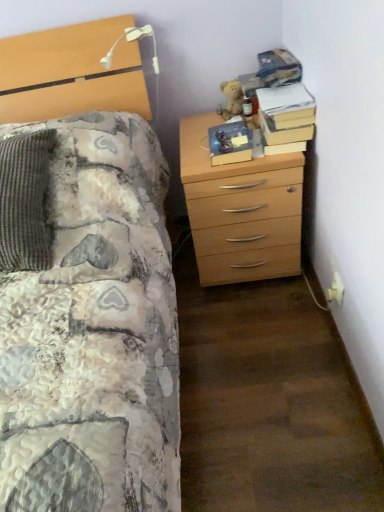
What do you see at coordinates (240, 209) in the screenshot? I see `light wood chest of drawers at right` at bounding box center [240, 209].

Locate an element on the screen. This screenshot has height=512, width=384. fuzzy brown teddy bear at upper right is located at coordinates click(231, 99).

You are a GUI agent. You are given a task and a screenshot of the screen. Output one action in this format:
    pyautogui.click(x=<x>, y=<y>)
    Task: Click on the hardcover book at upper right, positioned as the 2th book in left-to-right order
    The width and height of the screenshot is (384, 512).
    Given the screenshot: What is the action you would take?
    pyautogui.click(x=286, y=114)

Can we say fuzzy brown teddy bear at upper right lies outside hardcover book at upper right, which appears as the first book when viewed from the right?

Yes, fuzzy brown teddy bear at upper right is not within hardcover book at upper right, which appears as the first book when viewed from the right.

Between point (239, 111) and point (283, 121), which one is positioned behind?

The point (239, 111) is farther.

Does fuzzy brown teddy bear at upper right have a greater height compared to hardcover book at upper right, which appears as the first book when viewed from the right?

Correct, fuzzy brown teddy bear at upper right is much taller as hardcover book at upper right, which appears as the first book when viewed from the right.

Is hardcover book at center, which is the first book in left-to-right order, far from white plastic electric outlet at lower right?

They are positioned close to each other.

Is white plastic electric outlet at lower right completely or partially inside hardcover book at center, the second book in the right-to-left sequence?

No, hardcover book at center, the second book in the right-to-left sequence, does not contain white plastic electric outlet at lower right.

Is hardcover book at center, which is the first book in left-to-right order, wider than white plastic electric outlet at lower right?

Indeed, hardcover book at center, which is the first book in left-to-right order, has a greater width compared to white plastic electric outlet at lower right.

From a real-world perspective, is hardcover book at center, the second book in the right-to-left sequence, physically located above or below white plastic electric outlet at lower right?

Clearly, from a real-world perspective, hardcover book at center, the second book in the right-to-left sequence, is above white plastic electric outlet at lower right.

Is hardcover book at upper right, positioned as the 2th book in left-to-right order, oriented towards hardcover book at center, the second book in the right-to-left sequence?

No, hardcover book at upper right, positioned as the 2th book in left-to-right order, is not facing towards hardcover book at center, the second book in the right-to-left sequence.

Considering the relative positions of hardcover book at upper right, positioned as the 2th book in left-to-right order, and hardcover book at center, the second book in the right-to-left sequence, in the image provided, is hardcover book at upper right, positioned as the 2th book in left-to-right order, to the left of hardcover book at center, the second book in the right-to-left sequence, from the viewer's perspective?

No.

Can you confirm if hardcover book at upper right, which appears as the first book when viewed from the right, is taller than hardcover book at center, which is the first book in left-to-right order?

No, hardcover book at upper right, which appears as the first book when viewed from the right, is not taller than hardcover book at center, which is the first book in left-to-right order.

Could you measure the distance between hardcover book at upper right, positioned as the 2th book in left-to-right order, and hardcover book at center, the second book in the right-to-left sequence?

They are 14.72 centimeters apart.

Which of these two, light wood chest of drawers at right or fuzzy brown teddy bear at upper right, is bigger?

Bigger between the two is light wood chest of drawers at right.

How distant is light wood chest of drawers at right from fuzzy brown teddy bear at upper right?

A distance of 17.74 inches exists between light wood chest of drawers at right and fuzzy brown teddy bear at upper right.

In the image, is light wood chest of drawers at right on the left side or the right side of fuzzy brown teddy bear at upper right?

Based on their positions, light wood chest of drawers at right is located to the right of fuzzy brown teddy bear at upper right.

Between light wood chest of drawers at right and fuzzy brown teddy bear at upper right, which one has more height?

Standing taller between the two is light wood chest of drawers at right.

Is point (336, 290) farther from viewer compared to point (219, 128)?

No, (336, 290) is in front of (219, 128).

Which object is closer to the camera, white plastic electric outlet at lower right or hardcover book at center, which is the first book in left-to-right order?

white plastic electric outlet at lower right.

Is white plastic electric outlet at lower right not near hardcover book at center, the second book in the right-to-left sequence?

No.

How different are the orientations of white plastic electric outlet at lower right and hardcover book at center, the second book in the right-to-left sequence, in degrees?

89.4 degrees separate the facing orientations of white plastic electric outlet at lower right and hardcover book at center, the second book in the right-to-left sequence.

Considering the positions of objects fuzzy brown teddy bear at upper right and white plastic electric outlet at lower right in the image provided, who is more to the left, fuzzy brown teddy bear at upper right or white plastic electric outlet at lower right?

Positioned to the left is fuzzy brown teddy bear at upper right.

Considering the positions of point (235, 113) and point (335, 293), is point (235, 113) closer or farther from the camera than point (335, 293)?

Point (235, 113).

Is fuzzy brown teddy bear at upper right wider than white plastic electric outlet at lower right?

Yes.

Is hardcover book at upper right, positioned as the 2th book in left-to-right order, to the right of light wood chest of drawers at right from the viewer's perspective?

Yes, hardcover book at upper right, positioned as the 2th book in left-to-right order, is to the right of light wood chest of drawers at right.

Is hardcover book at upper right, positioned as the 2th book in left-to-right order, completely or partially outside of light wood chest of drawers at right?

Yes, hardcover book at upper right, positioned as the 2th book in left-to-right order, is located beyond the bounds of light wood chest of drawers at right.

Is hardcover book at upper right, positioned as the 2th book in left-to-right order, positioned in front of light wood chest of drawers at right?

No, it is not.

From the image's perspective, does hardcover book at upper right, positioned as the 2th book in left-to-right order, appear higher than light wood chest of drawers at right?

Correct, hardcover book at upper right, positioned as the 2th book in left-to-right order, appears higher than light wood chest of drawers at right in the image.

You are a GUI agent. You are given a task and a screenshot of the screen. Output one action in this format:
    pyautogui.click(x=<x>, y=<y>)
    Task: Click on the teddy on the left of the hardcover book at upper right, positioned as the 2th book in left-to-right order
    
    Given the screenshot: What is the action you would take?
    pyautogui.click(x=231, y=99)

From a real-world perspective, which book is the 1st one above the white plastic electric outlet at lower right? Please provide its 2D coordinates.

[(230, 143)]

From the image, which object appears to be farther from fuzzy brown teddy bear at upper right, hardcover book at center, which is the first book in left-to-right order, or hardcover book at upper right, which appears as the first book when viewed from the right?

hardcover book at upper right, which appears as the first book when viewed from the right, is positioned further to the anchor fuzzy brown teddy bear at upper right.

Based on the photo, when comparing their distances from white plastic electric outlet at lower right, does fuzzy brown teddy bear at upper right or hardcover book at upper right, which appears as the first book when viewed from the right, seem further?

fuzzy brown teddy bear at upper right is positioned further to the anchor white plastic electric outlet at lower right.

When comparing their distances from white plastic electric outlet at lower right, does light wood chest of drawers at right or hardcover book at upper right, positioned as the 2th book in left-to-right order, seem further?

The object further to white plastic electric outlet at lower right is hardcover book at upper right, positioned as the 2th book in left-to-right order.

Estimate the real-world distances between objects in this image. Which object is closer to fuzzy brown teddy bear at upper right, hardcover book at center, the second book in the right-to-left sequence, or light wood chest of drawers at right?

hardcover book at center, the second book in the right-to-left sequence.

Which object lies nearer to the anchor point fuzzy brown teddy bear at upper right, white plastic electric outlet at lower right or light wood chest of drawers at right?

The object closer to fuzzy brown teddy bear at upper right is light wood chest of drawers at right.

Based on their spatial positions, is hardcover book at center, the second book in the right-to-left sequence, or light wood chest of drawers at right further from hardcover book at upper right, which appears as the first book when viewed from the right?

light wood chest of drawers at right lies further to hardcover book at upper right, which appears as the first book when viewed from the right, than the other object.

Looking at the image, which one is located further to hardcover book at center, which is the first book in left-to-right order, hardcover book at upper right, positioned as the 2th book in left-to-right order, or fuzzy brown teddy bear at upper right?

fuzzy brown teddy bear at upper right is further to hardcover book at center, which is the first book in left-to-right order.

From the picture: Which object lies further to the anchor point hardcover book at upper right, which appears as the first book when viewed from the right, light wood chest of drawers at right or hardcover book at center, the second book in the right-to-left sequence?

light wood chest of drawers at right is positioned further to the anchor hardcover book at upper right, which appears as the first book when viewed from the right.

At what (x,y) coordinates should I click in order to perform the action: click on book between hardcover book at upper right, positioned as the 2th book in left-to-right order, and white plastic electric outlet at lower right from top to bottom. Please return your answer as a coordinate pair (x, y). Image resolution: width=384 pixels, height=512 pixels. Looking at the image, I should click on (230, 143).

The height and width of the screenshot is (512, 384). I want to click on book positioned between hardcover book at upper right, positioned as the 2th book in left-to-right order, and fuzzy brown teddy bear at upper right from near to far, so click(x=230, y=143).

Where is `book between hardcover book at upper right, positioned as the 2th book in left-to-right order, and light wood chest of drawers at right in the up-down direction`? book between hardcover book at upper right, positioned as the 2th book in left-to-right order, and light wood chest of drawers at right in the up-down direction is located at coordinates (230, 143).

The width and height of the screenshot is (384, 512). Find the location of `the chest of drawers that lies between fuzzy brown teddy bear at upper right and white plastic electric outlet at lower right from top to bottom`. the chest of drawers that lies between fuzzy brown teddy bear at upper right and white plastic electric outlet at lower right from top to bottom is located at coordinates (240, 209).